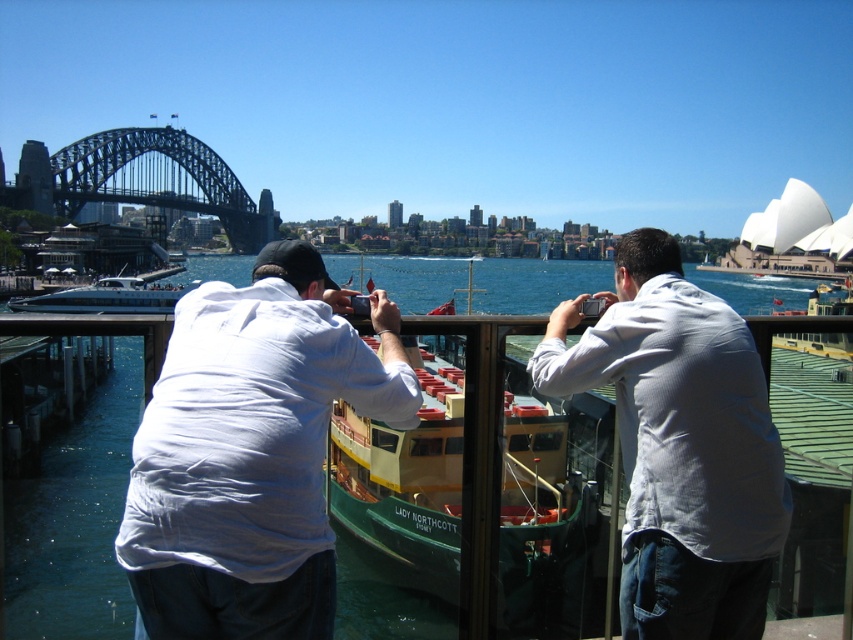
From the picture: Is light blue shirt at center thinner than green matte ferry at center?

Correct, light blue shirt at center's width is less than green matte ferry at center's.

Who is shorter, light blue shirt at center or green matte ferry at center?

green matte ferry at center

Between point (730, 426) and point (471, 374), which one is positioned behind?

Point (471, 374)

You are a GUI agent. You are given a task and a screenshot of the screen. Output one action in this format:
    pyautogui.click(x=<x>, y=<y>)
    Task: Click on the light blue shirt at center
    This screenshot has height=640, width=853.
    Given the screenshot: What is the action you would take?
    pyautogui.click(x=679, y=444)

Based on the photo, which is more to the left, light blue shirt at center or blue water at center?

Positioned to the left is blue water at center.

In the scene shown: Who is more distant from viewer, (695,291) or (12,568)?

Positioned behind is point (12,568).

Where is `light blue shirt at center`? light blue shirt at center is located at coordinates (679, 444).

Locate an element on the screen. The image size is (853, 640). green matte ferry at center is located at coordinates (461, 484).

This screenshot has height=640, width=853. What do you see at coordinates (461, 484) in the screenshot?
I see `green matte ferry at center` at bounding box center [461, 484].

Identify the location of green matte ferry at center. (461, 484).